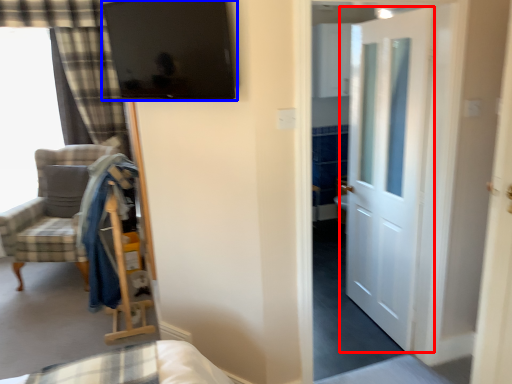
Question: Which object appears farthest to the camera in this image, door (highlighted by a red box) or window screen (highlighted by a blue box)?

Choices:
 (A) door
 (B) window screen

Answer: (A)